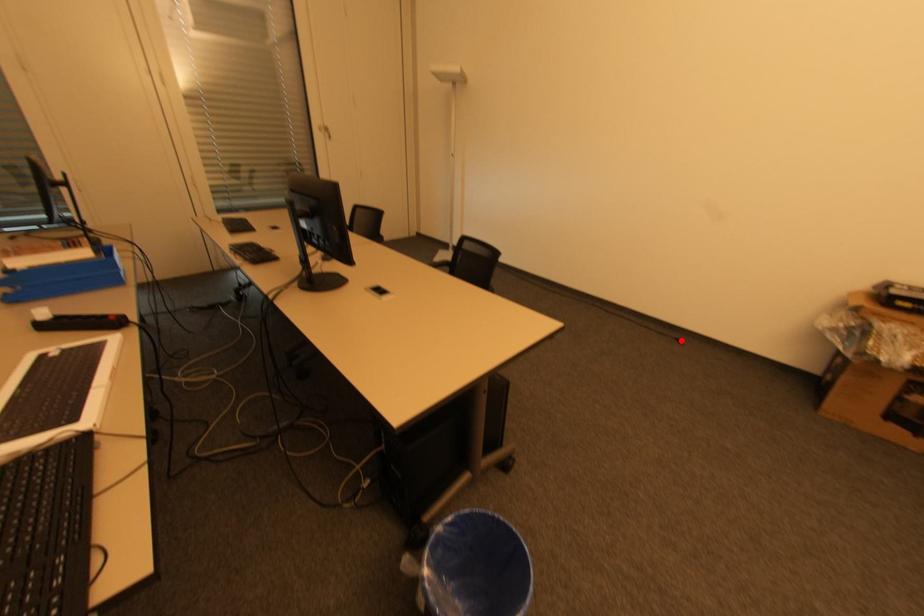
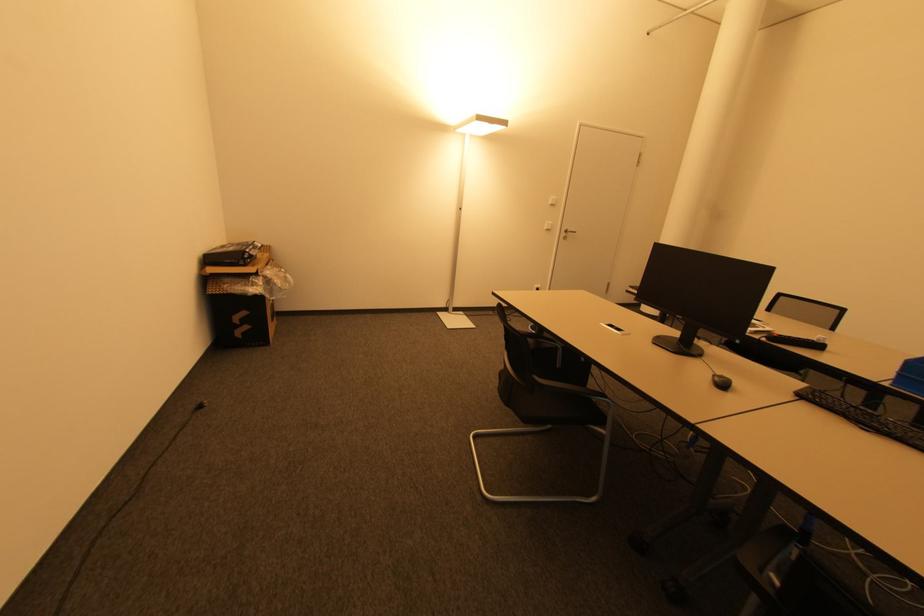
The point at the highlighted location is marked in the first image. Where is the corresponding point in the second image?

(201, 408)